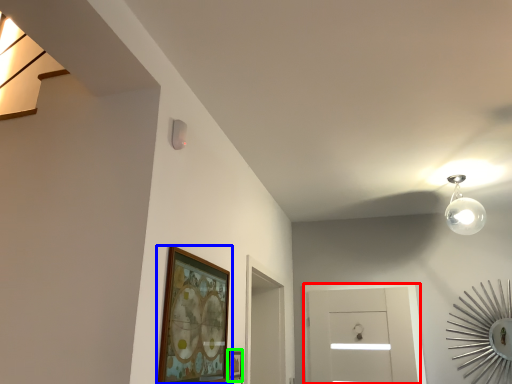
Question: Estimate the real-world distances between objects in this image. Which object is farther from glass door (highlighted by a red box), picture frame (highlighted by a blue box) or picture frame (highlighted by a green box)?

Choices:
 (A) picture frame
 (B) picture frame

Answer: (A)